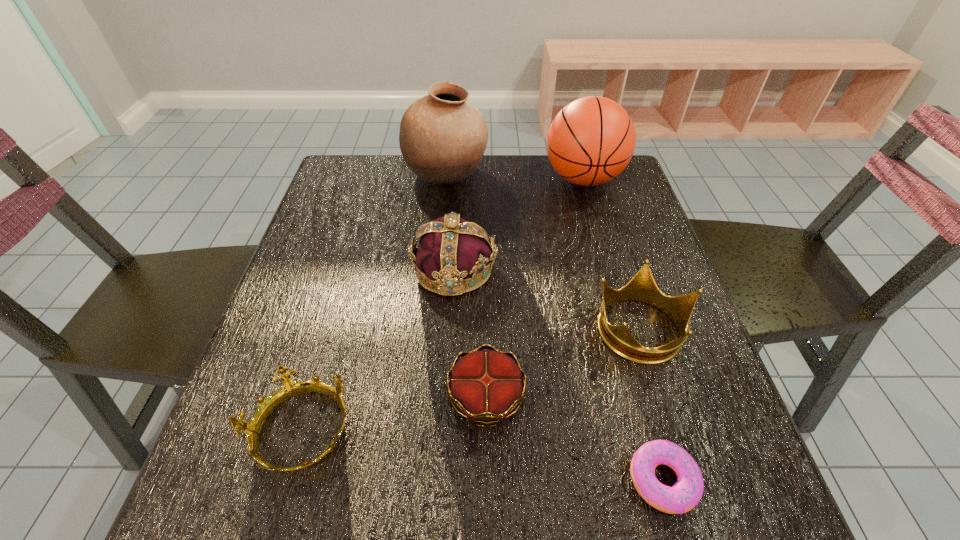
Where is `pottery`? pottery is located at coordinates (442, 137).

Where is `basketball`? The height and width of the screenshot is (540, 960). basketball is located at coordinates tap(591, 140).

The width and height of the screenshot is (960, 540). Identify the location of the tallest crown. (451, 250).

You are a GUI agent. You are given a task and a screenshot of the screen. Output one action in this format:
    pyautogui.click(x=<x>, y=<y>)
    Task: Click on the fourth shortest object
    The width and height of the screenshot is (960, 540).
    Given the screenshot: What is the action you would take?
    pyautogui.click(x=642, y=287)

The image size is (960, 540). I want to click on the third shortest crown, so click(x=642, y=287).

This screenshot has height=540, width=960. I want to click on the leftmost crown, so click(x=290, y=388).

Locate an element on the screen. doughnut is located at coordinates (684, 495).

This screenshot has width=960, height=540. In order to click on vacant space located 0.230m on the right of the pottery in this screenshot , I will do [566, 176].

I want to click on free spot located on the front of the basketball, so click(x=595, y=220).

Locate an element on the screen. vacant space located on the right of the third tallest object is located at coordinates (633, 269).